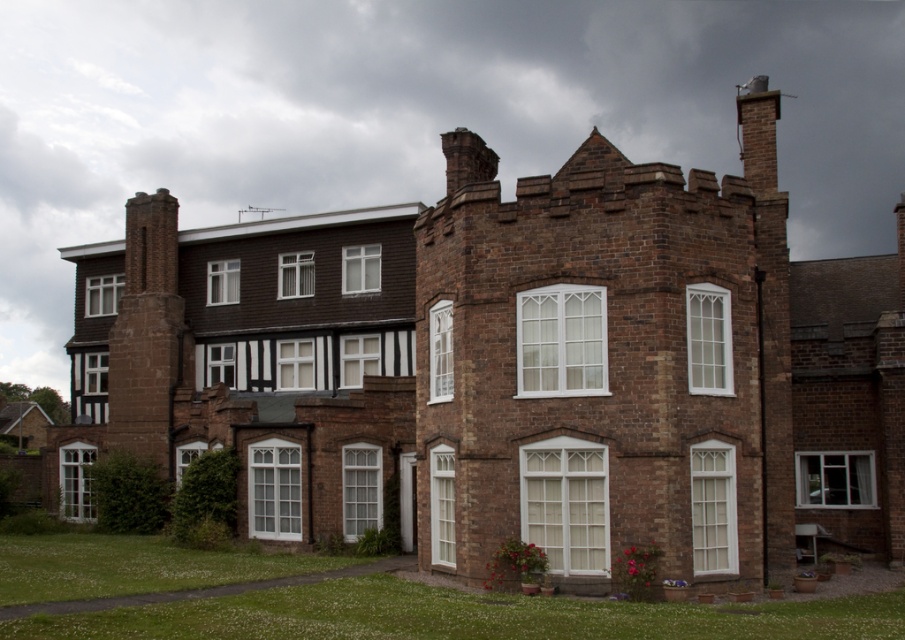
You are standing in front of the historic brick building and want to take a photo. You notice two points marked on the building. One is at coordinate point (435,253) and the other is at point (157,193). Which point is closer to your camera when taking the photo?

Point (435,253) is closer to the camera than point (157,193).

You are a drone operator tasked with capturing aerial footage of the building. The two chimneys are critical landmarks. If your drone can only travel 20 meters before needing a battery recharge, will it be able to fly from the brown brick chimney at upper right to the brown stone chimney at left without needing to recharge?

The distance between the brown brick chimney at upper right and the brown stone chimney at left is 25.24 meters. Since the drone can only travel 20 meters before needing a recharge, it cannot make the trip without recharging.

You are standing in front of the historic brick building and want to locate the brown brick chimney at upper right. Based on the coordinates provided in the description, can you determine its position relative to the building?

The brown brick chimney at upper right is located at point (606, 362), which means it is positioned approximately 56.7 percent from the left edge and 67.1 percent from the bottom edge of the building, placing it towards the upper right section of the structure.